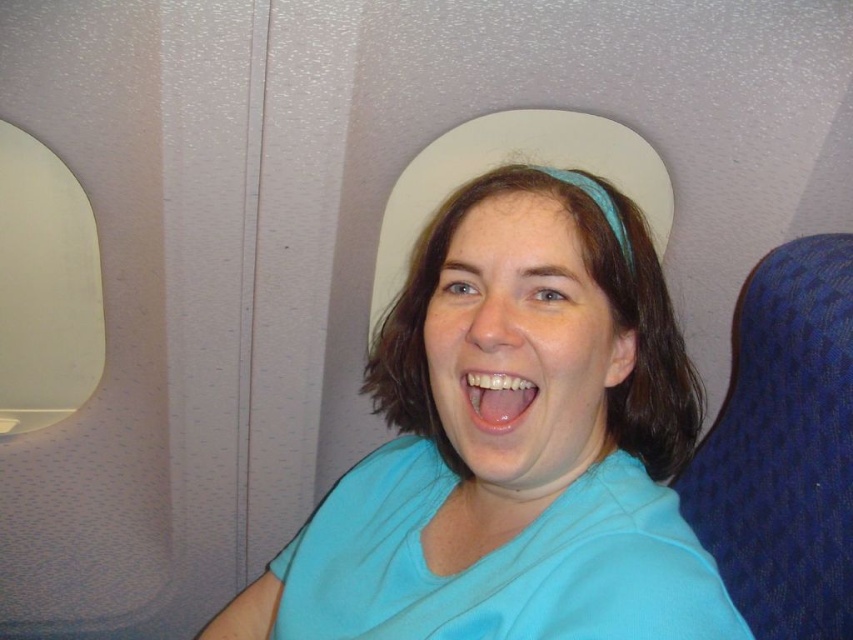
Which is below, light blue fabric at center or matte white teeth at center?

light blue fabric at center is below.

Is light blue fabric at center thinner than matte white teeth at center?

In fact, light blue fabric at center might be wider than matte white teeth at center.

Identify the location of light blue fabric at center. Image resolution: width=853 pixels, height=640 pixels. (512, 445).